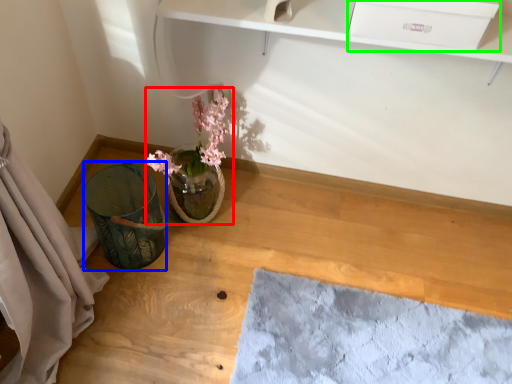
Question: Which object is the closest to the floral arrangement (highlighted by a red box)? Choose among these: vase (highlighted by a blue box) or drawer (highlighted by a green box).

Choices:
 (A) vase
 (B) drawer

Answer: (A)